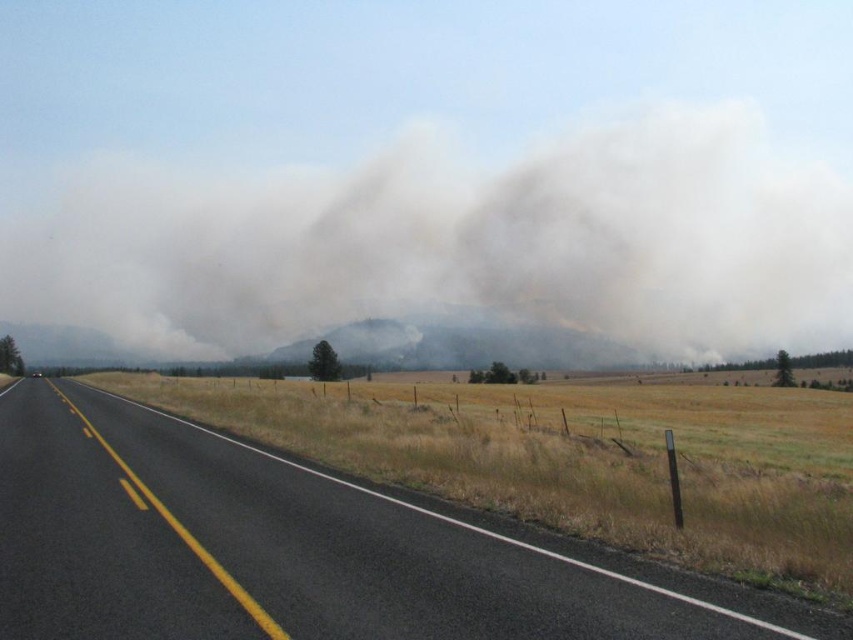
Between smoke/dense at center and black asphalt road at center, which one is positioned higher?

Positioned higher is smoke/dense at center.

Does smoke/dense at center lie behind black asphalt road at center?

Yes.

Who is more forward, (527, 288) or (183, 508)?

Point (183, 508) is more forward.

Find the location of a particular element. smoke/dense at center is located at coordinates (459, 243).